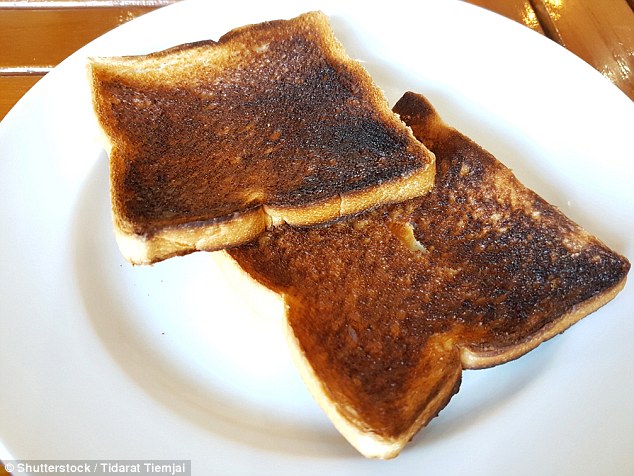
At what (x,y) coordinates should I click in order to perform the action: click on rust colored tile. Please return your answer as a coordinate pair (x, y). This screenshot has height=476, width=634. Looking at the image, I should click on (42, 45), (10, 90).